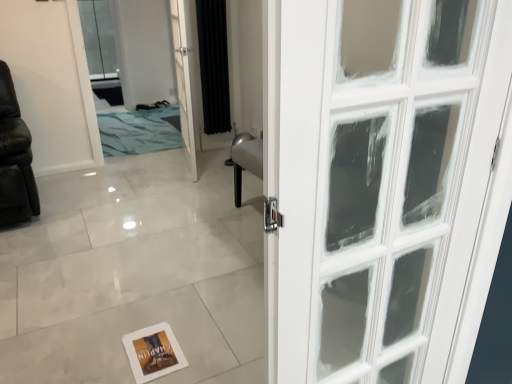
This screenshot has width=512, height=384. I want to click on vacant region to the left of white glass door at center, so pos(152,168).